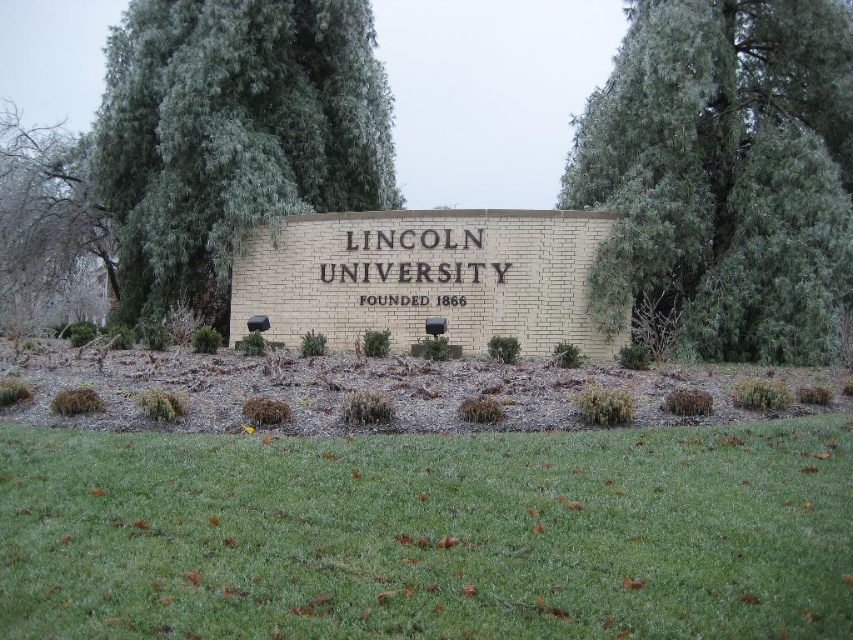
You are standing in front of the Lincoln University sign. There is a point marked at coordinates (x=428, y=534). Based on the scene description, what is the color of the ground at that point?

The point at coordinates (x=428, y=534) corresponds to green grass at lower center, so the color of the ground at that point is green.